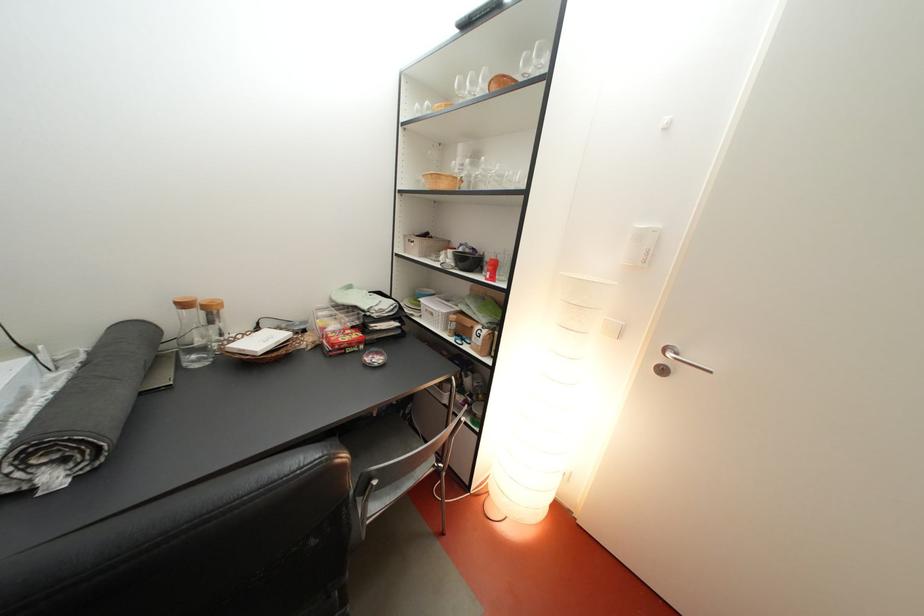
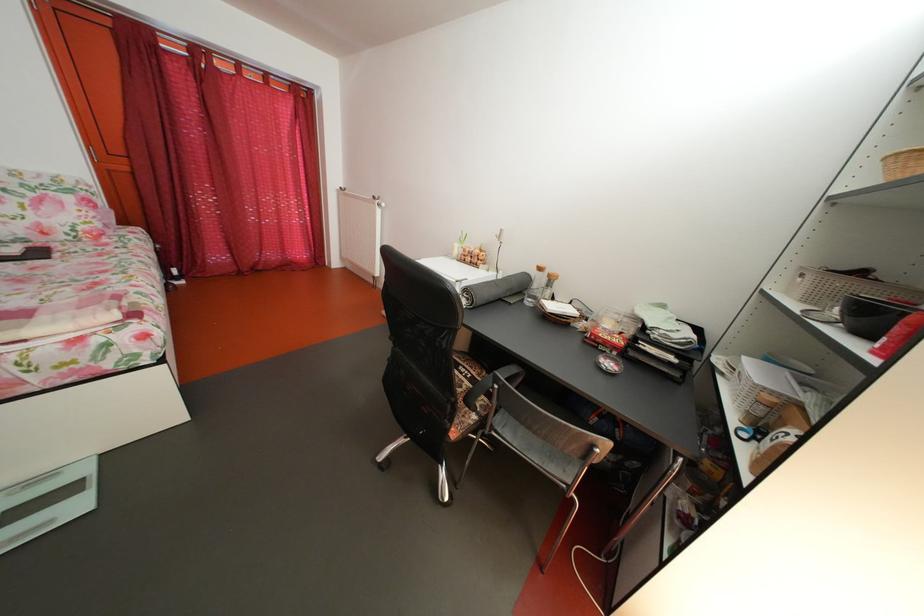
Question: Based on the continuous images, in which direction is the camera rotating? Reply with the corresponding letter.

Choices:
 (A) Left
 (B) Right
 (C) Up
 (D) Down

Answer: (A)